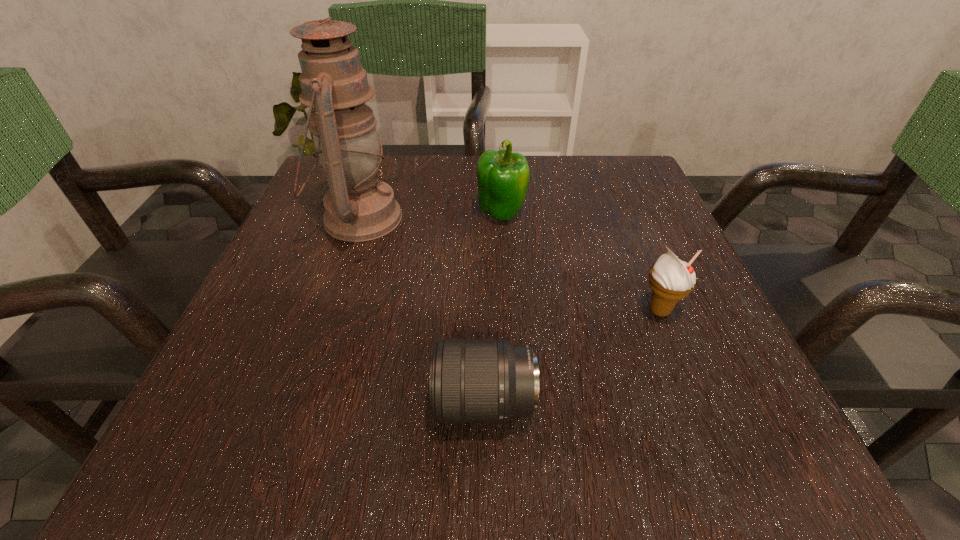
In the image, there is a desktop. What are the coordinates of `vacant space at the near edge` in the screenshot? It's located at (535, 435).

The width and height of the screenshot is (960, 540). I want to click on free space at the left edge of the desktop, so tap(257, 291).

At what (x,y) coordinates should I click in order to perform the action: click on vacant area at the far right corner. Please return your answer as a coordinate pair (x, y). Looking at the image, I should click on (651, 190).

Locate an element on the screen. This screenshot has height=540, width=960. vacant space at the near right corner of the desktop is located at coordinates (677, 459).

Where is `free space that is in between the rightmost object and the second tallest object`? The height and width of the screenshot is (540, 960). free space that is in between the rightmost object and the second tallest object is located at coordinates (581, 262).

Locate an element on the screen. The image size is (960, 540). free spot between the telephoto lens and the third tallest object is located at coordinates tap(572, 356).

Locate an element on the screen. This screenshot has height=540, width=960. unoccupied position between the icecream and the tallest object is located at coordinates (509, 265).

Where is `unoccupied position between the second tallest object and the leftmost object`? The width and height of the screenshot is (960, 540). unoccupied position between the second tallest object and the leftmost object is located at coordinates (430, 216).

Locate an element on the screen. The height and width of the screenshot is (540, 960). vacant area that lies between the shortest object and the tallest object is located at coordinates (421, 310).

Identify the location of vacant point located between the icecream and the tallest object. The image size is (960, 540). (509, 265).